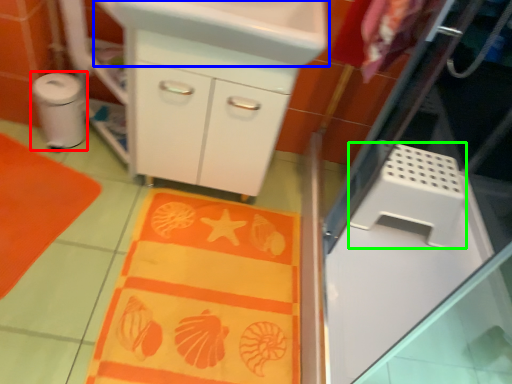
Question: Estimate the real-world distances between objects in this image. Which object is farther from appliance (highlighted by a red box), sink (highlighted by a blue box) or appliance (highlighted by a green box)?

Choices:
 (A) sink
 (B) appliance

Answer: (B)